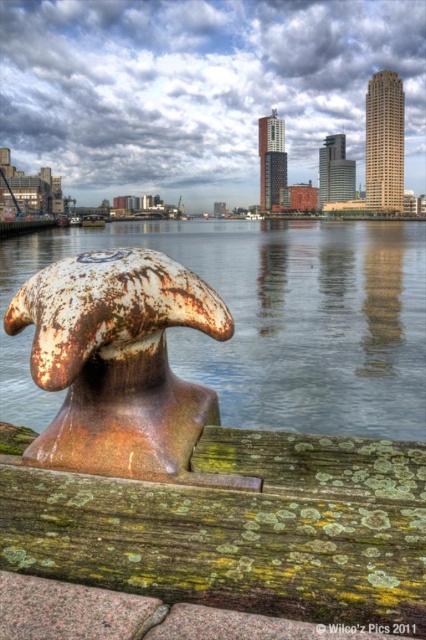
You are a photographer planning to capture the waterfront scene. You notice two rusty metal bollards in the foreground. Which one, the rusty metal bollard at lower left or the rusty metal bollard at left, should you focus on to ensure it appears larger in your photo?

The rusty metal bollard at lower left is bigger than the rusty metal bollard at left, so focusing on the rusty metal bollard at lower left will make it appear larger in the photo.

You are standing at the waterfront and want to place a small decorative rock between the green mossy wood at lower center and the rusty metal bollard at left. Which object should you place the rock closer to?

The green mossy wood at lower center is positioned on the right side of the rusty metal bollard at left, so you should place the rock closer to the green mossy wood at lower center to be between them.

You are standing at the edge of the waterfront scene and want to place a small decorative rock on the green mossy wood at lower center. What are the coordinates where you should place it?

The coordinates for placing the small decorative rock on the green mossy wood at lower center are at point (241,529).